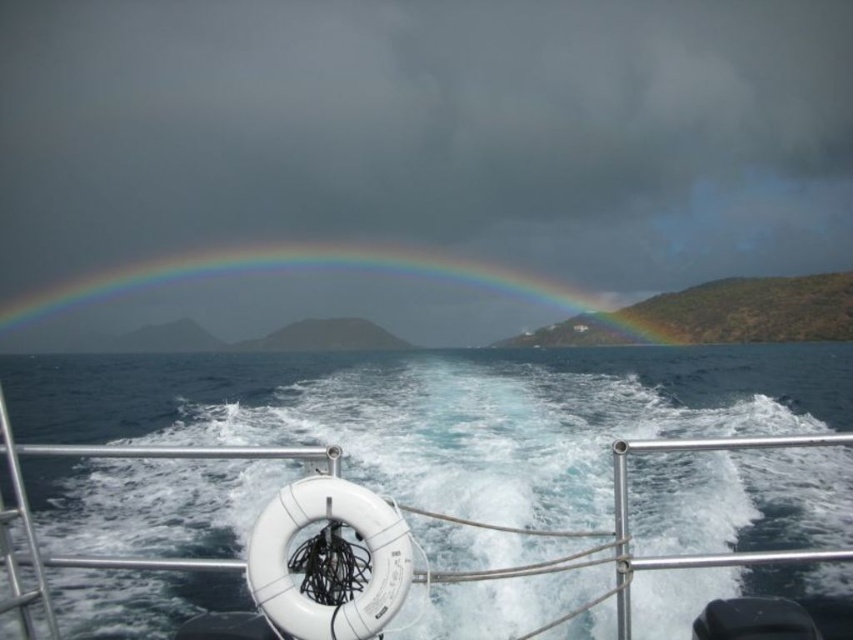
You are standing on the boat and want to take a photo of both the blue water at center and the rainbow at center. Which object should you adjust your camera to focus on first to ensure both are in the frame?

The blue water at center is positioned on the right side of rainbow at center, so you should focus on the rainbow at center first to ensure both are captured in the frame.

You are on a boat and want to know which of the two points, point (651, 474) or point (33, 326), is closer to you. Based on the scene, can you determine this?

Answer: Point (651, 474) is closer to the camera than point (33, 326), so the point closer to you is point (651, 474).

Consider the image. You are on a boat and want to take a photo of the rainbow at center and the blue water at center. Which one should you focus on first to ensure both are in focus?

The blue water at center is closer to the viewer than the rainbow at center. To ensure both are in focus, focus on the blue water at center first as it is closer, and the rainbow at center will naturally fall into focus behind it.